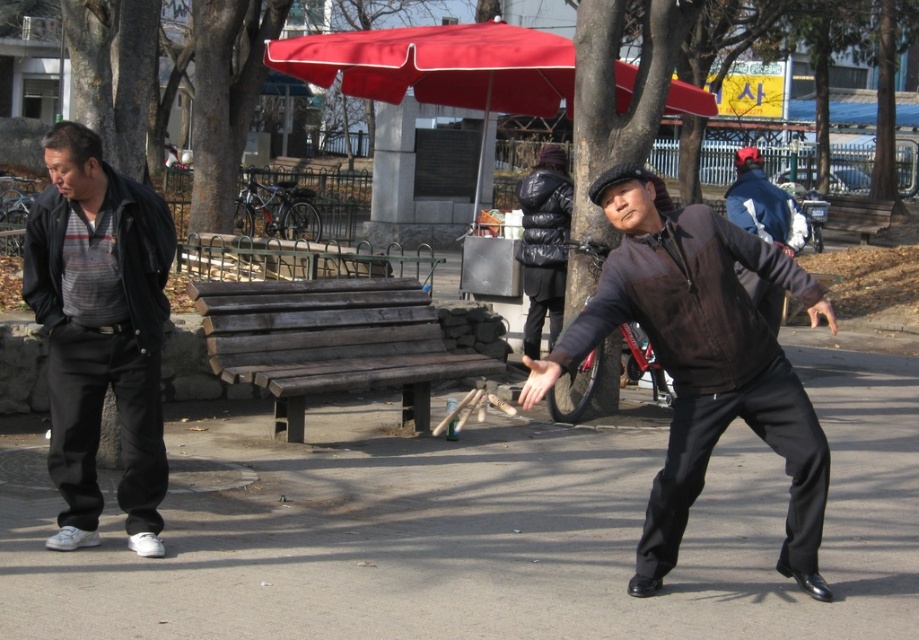
You are a photographer planning to take a group photo of the matte black jacket at left and the dark brown wood bench at center. Which object should be placed closer to the camera to ensure both appear proportionally sized in the photo?

The matte black jacket at left is smaller in size compared to the dark brown wood bench at center. To make them appear proportionally sized in the photo, the matte black jacket at left should be placed closer to the camera than the dark brown wood bench at center.

Which object is taller between the dark brown wood bench at center and the red fabric umbrella at upper center?

The red fabric umbrella at upper center is taller than the dark brown wood bench at center.